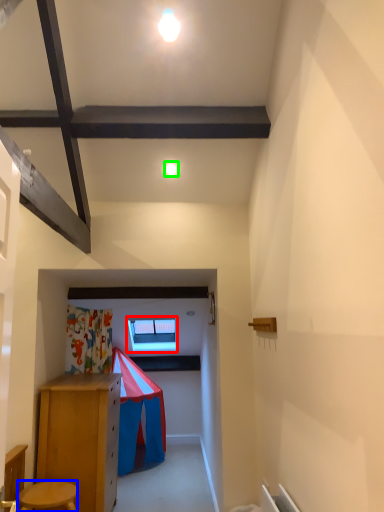
Question: Considering the real-world distances, which object is closest to window (highlighted by a red box)? stool (highlighted by a blue box) or light (highlighted by a green box).

Choices:
 (A) stool
 (B) light

Answer: (A)